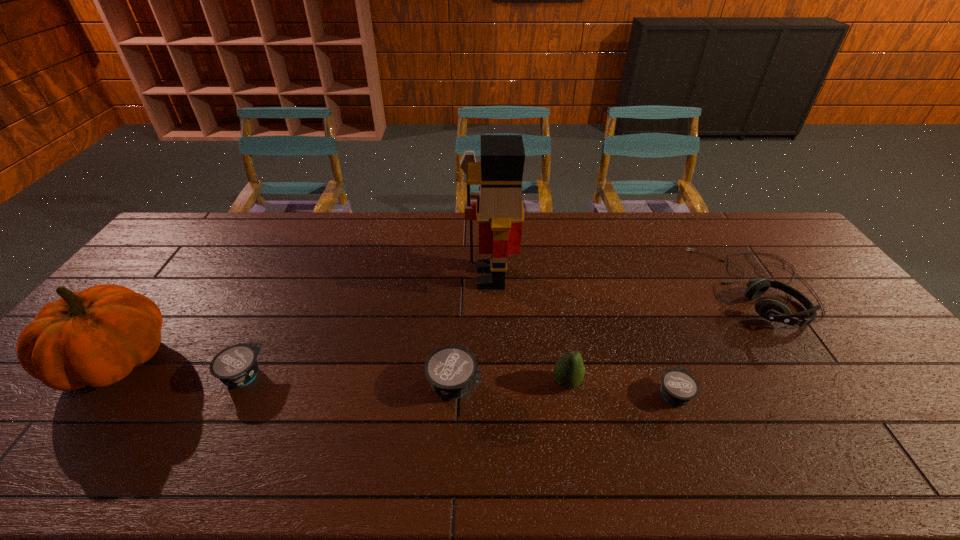
You are a GUI agent. You are given a task and a screenshot of the screen. Output one action in this format:
    pyautogui.click(x=<x>, y=<y>)
    Task: Click on the unoccupied position between the rightmost object and the nutcracker
    
    Given the screenshot: What is the action you would take?
    pyautogui.click(x=624, y=282)

Image resolution: width=960 pixels, height=540 pixels. I want to click on object that is the second closest to the second yogurt from left to right, so click(499, 209).

Identify which object is located as the second nearest to the headset. Please provide its 2D coordinates. Your answer should be formatted as a tuple, i.e. [(x, y)], where the tuple contains the x and y coordinates of a point satisfying the conditions above.

[(569, 370)]

Image resolution: width=960 pixels, height=540 pixels. I want to click on yogurt that is the third closest one to the tallest object, so [236, 366].

Identify which yogurt is the second closest to the second tallest object. Please provide its 2D coordinates. Your answer should be formatted as a tuple, i.e. [(x, y)], where the tuple contains the x and y coordinates of a point satisfying the conditions above.

[(452, 370)]

The height and width of the screenshot is (540, 960). Identify the location of vacant space that satisfies the following two spatial constraints: 1. on the front side of the second object from right to left; 2. on the left side of the avocado. (568, 394).

Where is `free space that satisfies the following two spatial constraints: 1. on the front side of the tallest yogurt; 2. on the left side of the pumpkin`? free space that satisfies the following two spatial constraints: 1. on the front side of the tallest yogurt; 2. on the left side of the pumpkin is located at coordinates (99, 385).

Where is `free region that satisfies the following two spatial constraints: 1. on the front side of the second object from right to left; 2. on the right side of the avocado`? The width and height of the screenshot is (960, 540). free region that satisfies the following two spatial constraints: 1. on the front side of the second object from right to left; 2. on the right side of the avocado is located at coordinates (568, 394).

Where is `vacant region that satisfies the following two spatial constraints: 1. in front of the nutcracker holding the staff; 2. on the front side of the leftmost object`? This screenshot has height=540, width=960. vacant region that satisfies the following two spatial constraints: 1. in front of the nutcracker holding the staff; 2. on the front side of the leftmost object is located at coordinates (492, 361).